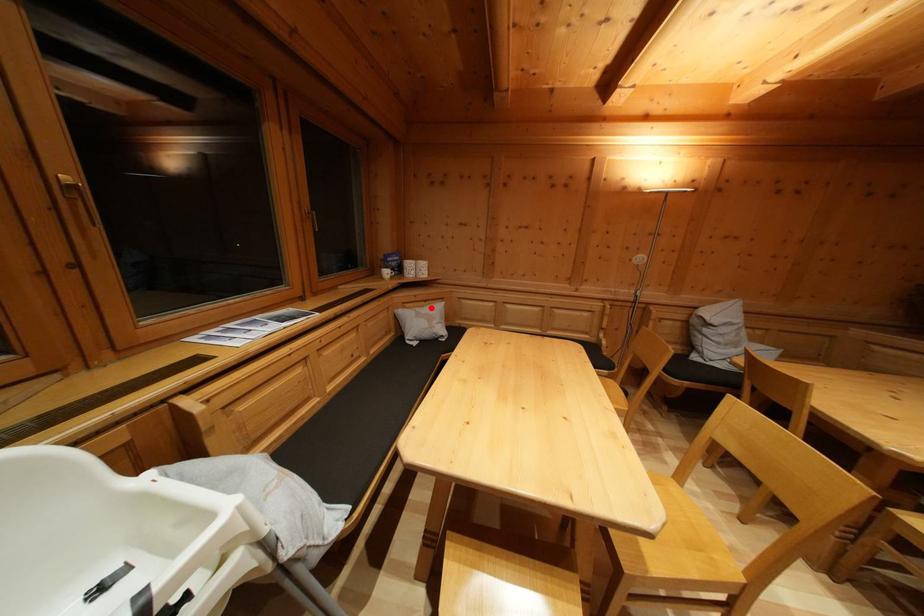
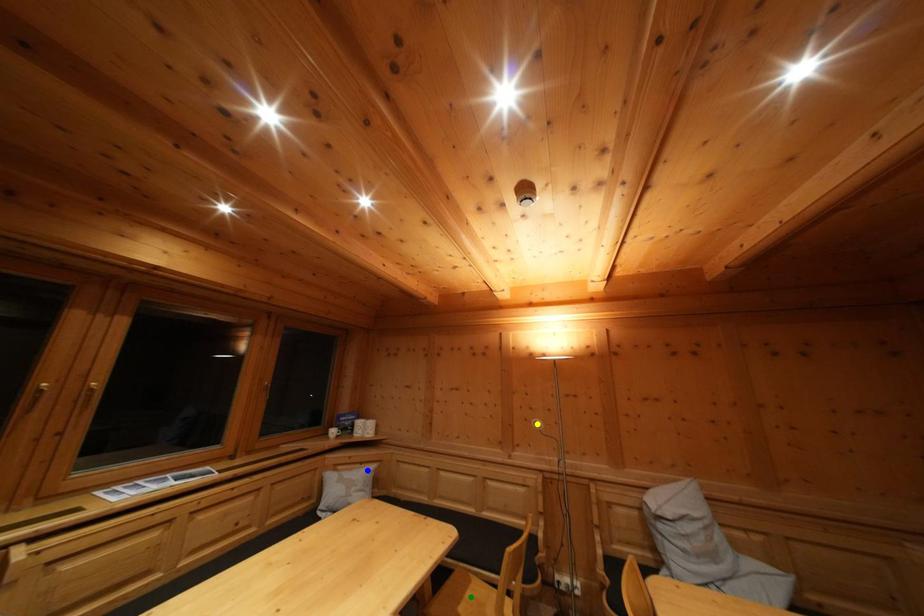
Question: I am providing you with two images of the same scene from different viewpoints. A red point is marked on the first image. You are given multiple points on the second image. Can you choose the point in image 2 that corresponds to the point in image 1?

Choices:
 (A) yellow point
 (B) green point
 (C) blue point

Answer: (C)